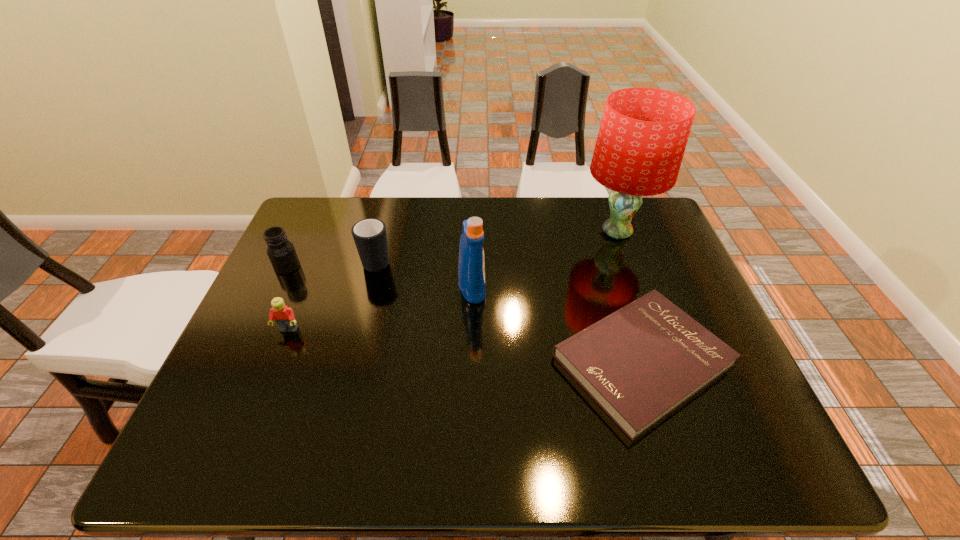
At what (x,y) coordinates should I click in order to perform the action: click on jar that is at the left edge. Please return your answer as a coordinate pair (x, y). This screenshot has height=540, width=960. Looking at the image, I should click on (281, 252).

Find the location of a particular element. Image resolution: width=960 pixels, height=540 pixels. Lego positioned at the left edge is located at coordinates (284, 316).

Find the location of a particular element. lampshade present at the right edge is located at coordinates (643, 134).

Locate an element on the screen. This screenshot has width=960, height=540. hardback book that is at the right edge is located at coordinates (640, 363).

This screenshot has height=540, width=960. Identify the location of object that is at the far right corner. (643, 134).

Find the location of a particular element. Image resolution: width=960 pixels, height=540 pixels. object that is positioned at the near right corner is located at coordinates coord(640,363).

The image size is (960, 540). What are the coordinates of `vacant position at the far edge of the desktop` in the screenshot? It's located at (463, 210).

You are a GUI agent. You are given a task and a screenshot of the screen. Output one action in this format:
    pyautogui.click(x=<x>, y=<y>)
    Task: Click on the free space at the near edge of the desktop
    
    Given the screenshot: What is the action you would take?
    pyautogui.click(x=535, y=464)

Where is `vacant space at the left edge of the desktop`? Image resolution: width=960 pixels, height=540 pixels. vacant space at the left edge of the desktop is located at coordinates (310, 299).

Find the location of a particular element. vacant area at the right edge of the desktop is located at coordinates (x=620, y=244).